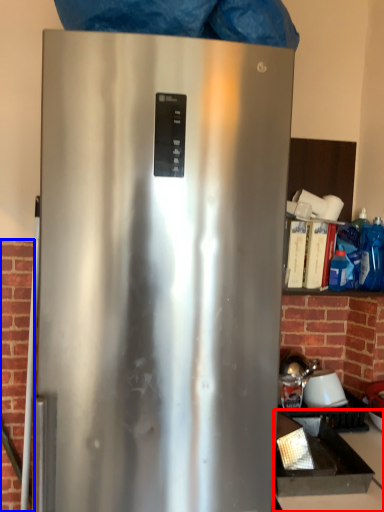
Question: Which object appears farthest to the camera in this image, counter top (highlighted by a red box) or brickwork (highlighted by a blue box)?

Choices:
 (A) counter top
 (B) brickwork

Answer: (B)